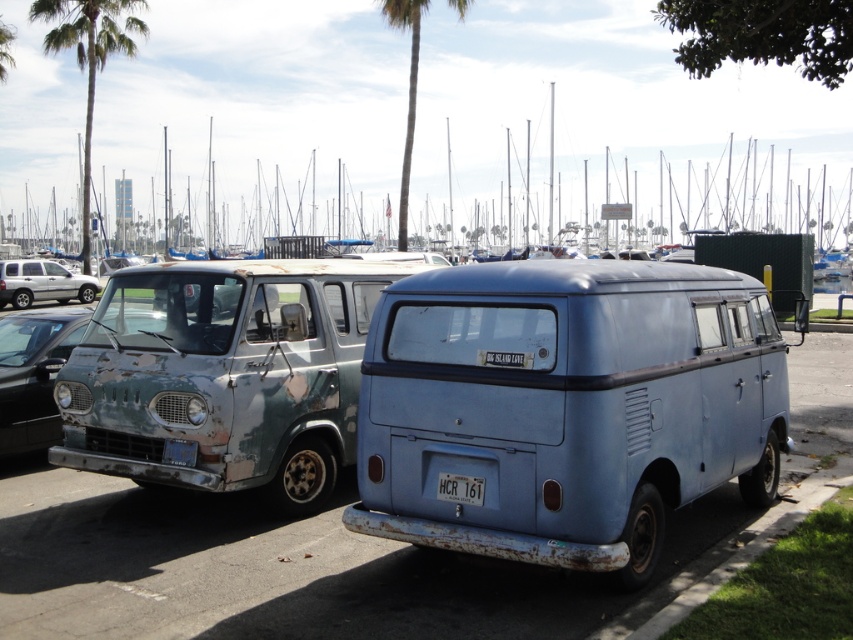
You are a delivery person trying to reach the loading dock behind the vehicles. The rusty metal van at center and the rusty metal van at left are blocking your path. Which vehicle should you move first to gain access to the loading dock?

The rusty metal van at center is positioned under the rusty metal van at left, so you should move the rusty metal van at left first to access the loading dock behind both vehicles.

You are a photographer planning to take a photo of both rusty metal van at center and rusty metal van at left. You want to ensure both are visible in the frame. Based on their positions, which van should you position closer to the left side of the camera frame?

The rusty metal van at left is already positioned to the left of the rusty metal van at center, so to include both in the frame, you should position the rusty metal van at left closer to the left side of the camera frame.